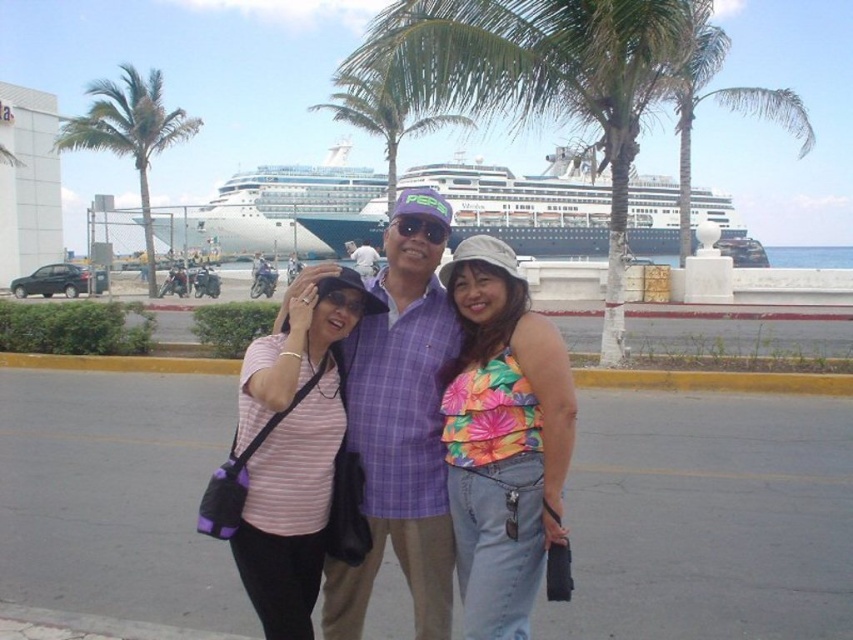
Who is positioned more to the right, striped cotton shirt at center or purple plaid shirt at center?

purple plaid shirt at center is more to the right.

Between point (358, 337) and point (421, 394), which one is positioned behind?

The point (358, 337) is more distant.

Is point (440, 388) farther from camera compared to point (431, 308)?

No, (440, 388) is in front of (431, 308).

I want to click on striped cotton shirt at center, so click(401, 424).

Can you confirm if floral fabric tank top at center is taller than purple plaid shirt at center?

Incorrect, floral fabric tank top at center's height is not larger of purple plaid shirt at center's.

Who is more forward, (541, 364) or (410, 488)?

Positioned in front is point (541, 364).

Where is `floral fabric tank top at center`? The image size is (853, 640). floral fabric tank top at center is located at coordinates [x=503, y=440].

Is purple plaid shirt at center positioned in front of pink striped shirt at center?

No.

Is purple plaid shirt at center below pink striped shirt at center?

No, purple plaid shirt at center is not below pink striped shirt at center.

The image size is (853, 640). What do you see at coordinates (401, 426) in the screenshot?
I see `purple plaid shirt at center` at bounding box center [401, 426].

I want to click on purple plaid shirt at center, so 401,426.